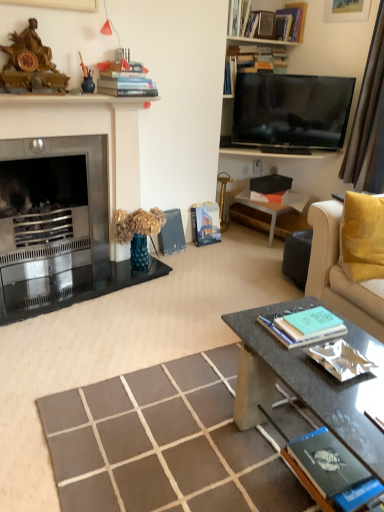
Locate an element on the screen. The image size is (384, 512). vacant space situated above shiny metallic book at center-right, the eighth book positioned from the top (from a real-world perspective) is located at coordinates (335, 359).